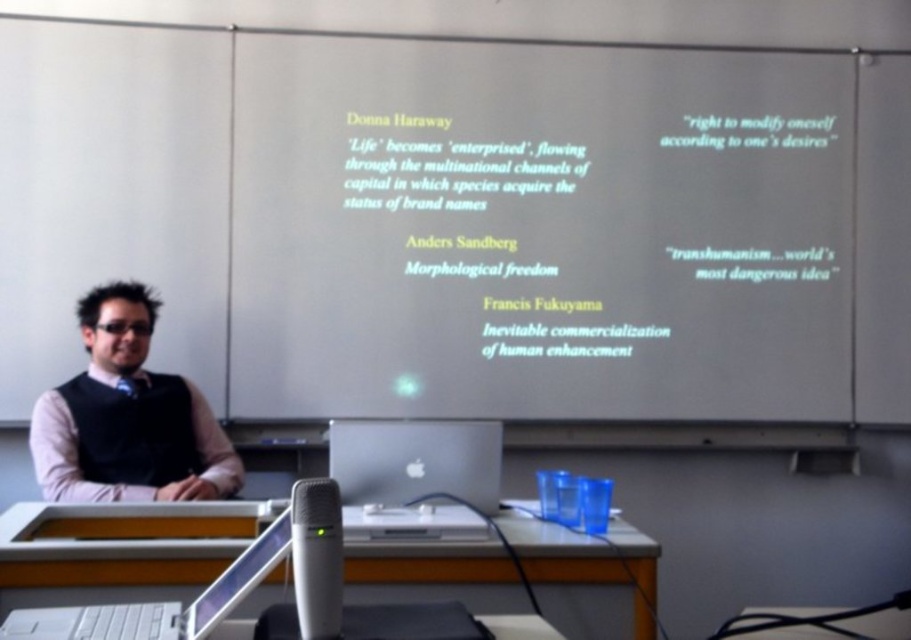
You are organizing a presentation and need to place a 18 inch long cable between the silver metallic computer at center and the white plastic laptop at lower center. Will the cable be long enough to connect them without needing an extension?

The distance between the silver metallic computer at center and the white plastic laptop at lower center is 20.21 inches. Since the cable is 18 inches long, it is shorter than the required distance. The cable will not be long enough to connect them without an extension.

You are standing in the classroom and want to determine which of the two points, point (466, 534) or point (97, 612), is closer to you. Based on the scene description, which point is nearer?

Point (466, 534) is further to the viewer than point (97, 612). Wait, but the question asks which is closer. Hmm, the description says point 0.836 is further to the viewer than point 0.959. So that means point 0.959 is closer to the viewer. Therefore, the answer should be point (97, 612) is closer.

You are organizing a presentation and need to place a name tag on the white paper at upper center and the matte black vest at left. Which object should you place the name tag on if you want it to be more visible from the back of the room?

The white paper at upper center should be chosen because it is wider than the matte black vest at left, making it a larger and more visible surface for the name tag.